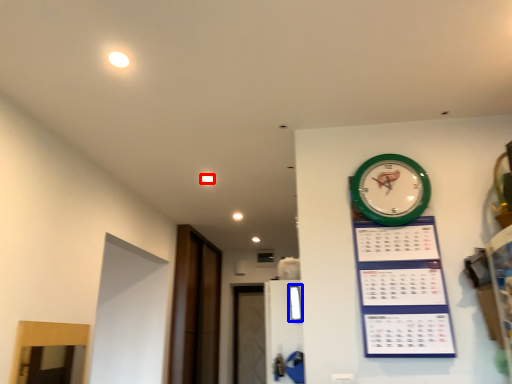
Question: Among these objects, which one is farthest to the camera, light (highlighted by a red box) or window (highlighted by a blue box)?

Choices:
 (A) light
 (B) window

Answer: (A)